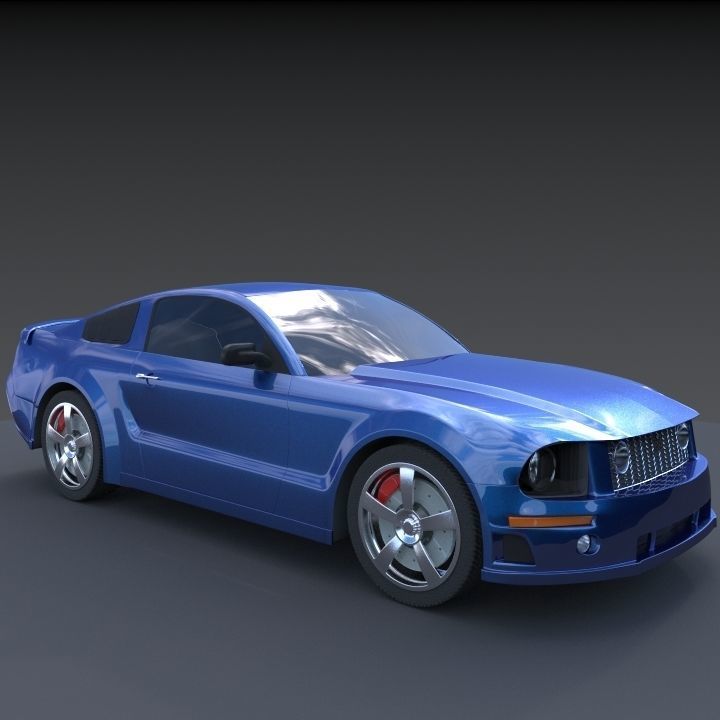
Find the location of a particular element. This screenshot has height=720, width=720. door is located at coordinates (225, 426).